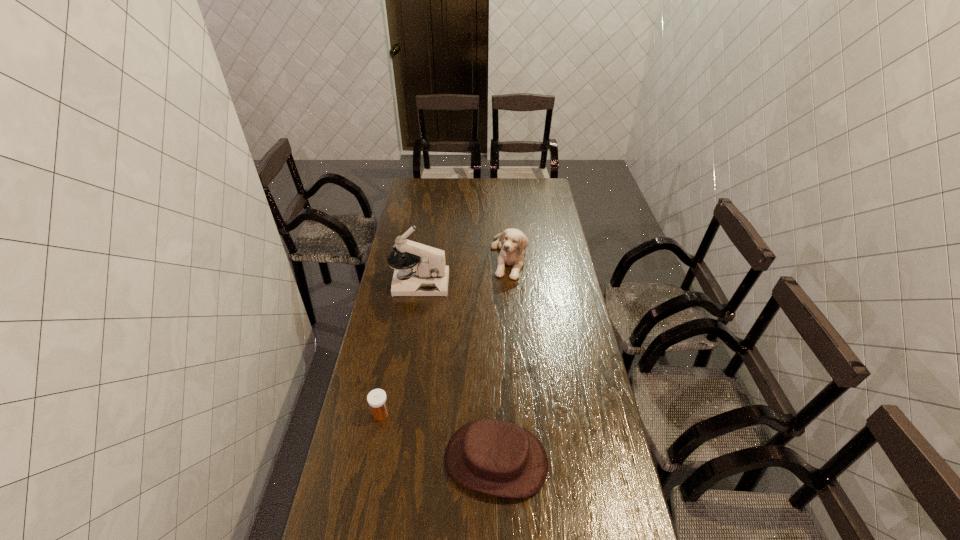
Where is `free space between the microscope and the nearest object`? The image size is (960, 540). free space between the microscope and the nearest object is located at coordinates (458, 372).

Identify the location of free space between the tallest object and the puppy. The height and width of the screenshot is (540, 960). (465, 270).

Where is `unoccupied area between the third tallest object and the puppy`? Image resolution: width=960 pixels, height=540 pixels. unoccupied area between the third tallest object and the puppy is located at coordinates (502, 359).

Find the location of a particular element. Image resolution: width=960 pixels, height=540 pixels. vacant space that's between the medicine and the third shortest object is located at coordinates (444, 335).

Identify the location of vacant area between the microscope and the third farthest object. (400, 348).

Locate an element on the screen. Image resolution: width=960 pixels, height=540 pixels. free spot between the tallest object and the puppy is located at coordinates (465, 270).

Identify which object is the third closest to the second nearest object. Please provide its 2D coordinates. Your answer should be formatted as a tuple, i.e. [(x, y)], where the tuple contains the x and y coordinates of a point satisfying the conditions above.

[(512, 242)]

What are the coordinates of `object that ranks as the closest to the third farthest object` in the screenshot? It's located at (495, 457).

You are a GUI agent. You are given a task and a screenshot of the screen. Output one action in this format:
    pyautogui.click(x=<x>, y=<y>)
    Task: Click on the free space that satisfies the following two spatial constraints: 1. at the eyepiece of the microscope; 2. on the left side of the hat
    Image resolution: width=960 pixels, height=540 pixels.
    Given the screenshot: What is the action you would take?
    pyautogui.click(x=393, y=461)

Locate an element on the screen. The image size is (960, 540). free space in the image that satisfies the following two spatial constraints: 1. on the front-facing side of the puppy; 2. at the eyepiece of the microscope is located at coordinates (511, 284).